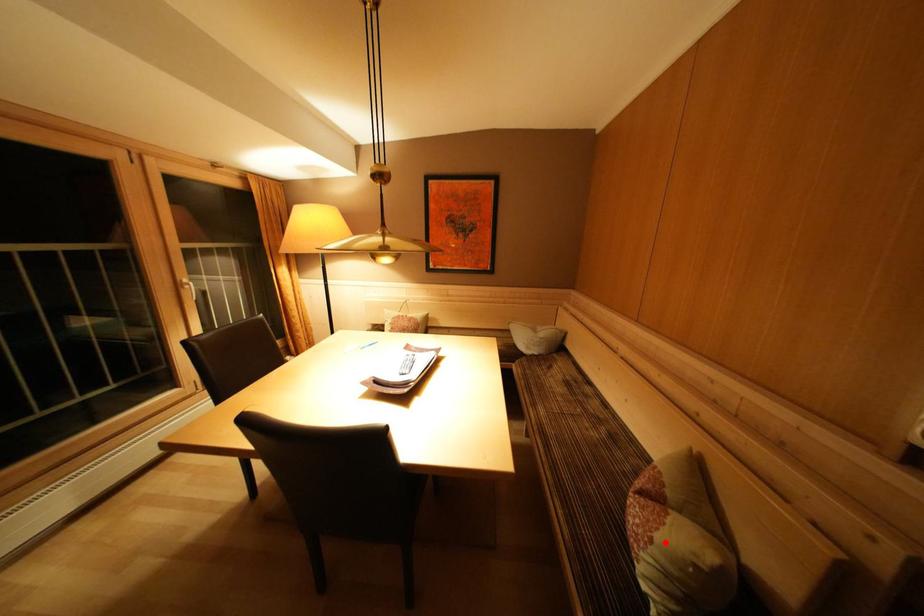
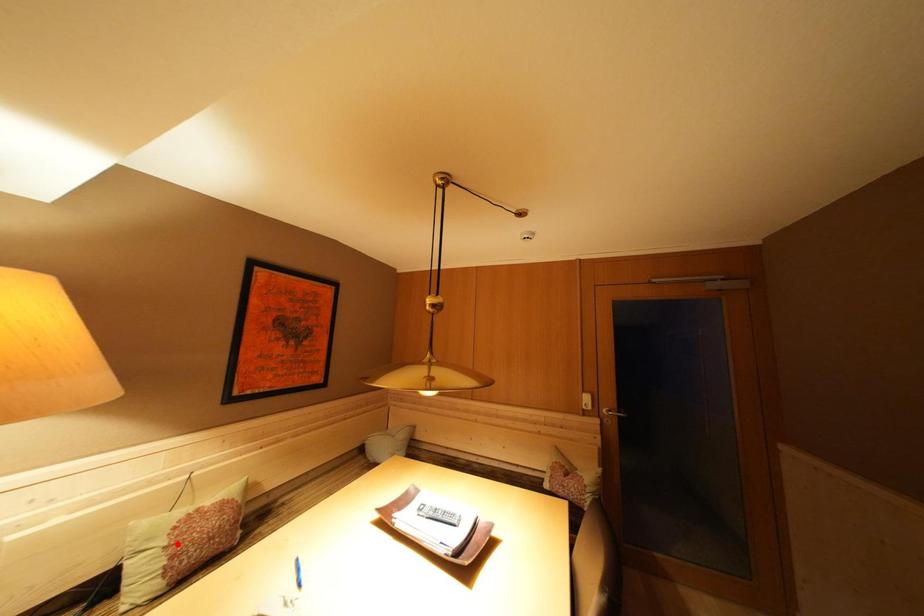
I am providing you with two images of the same scene from different viewpoints. A red point is marked on the first image and another point is marked on the second image. Are the points marked in image1 and image2 representing the same 3D position?

No